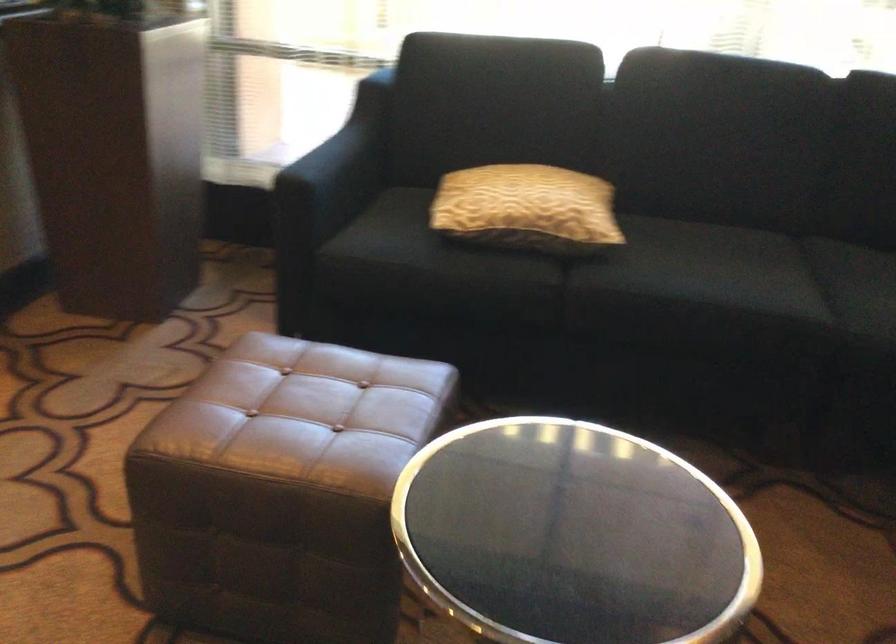
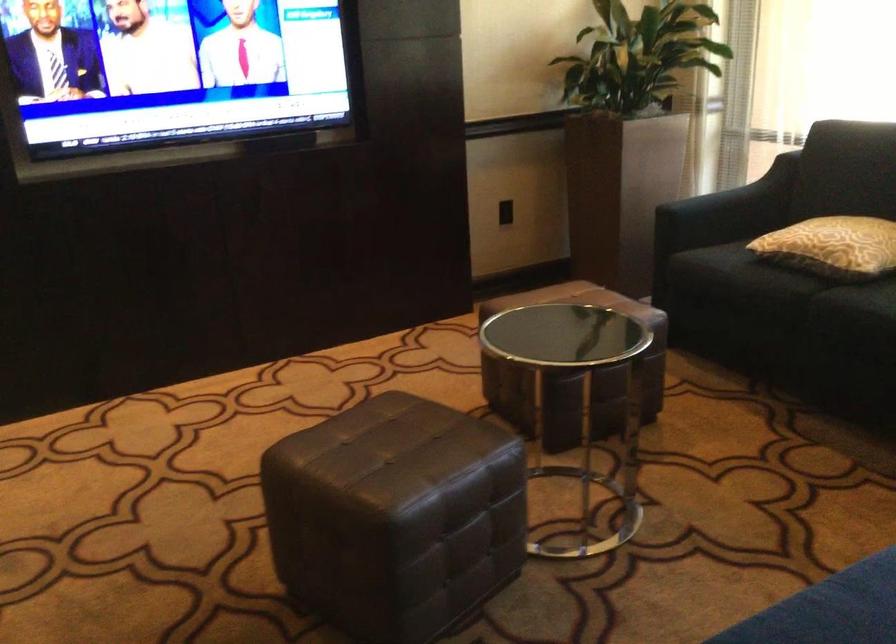
Locate, in the second image, the point that corresponds to (488,281) in the first image.

(767, 283)